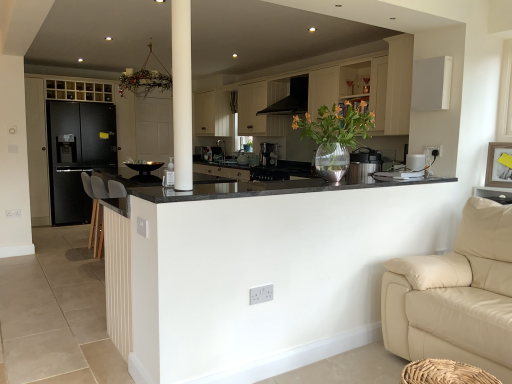
The width and height of the screenshot is (512, 384). What do you see at coordinates (456, 296) in the screenshot?
I see `beige leather couch at lower right` at bounding box center [456, 296].

The width and height of the screenshot is (512, 384). What do you see at coordinates (246, 187) in the screenshot? I see `black granite countertop at center` at bounding box center [246, 187].

At what (x,y) coordinates should I click in order to perform the action: click on clear glass vase at center. Please return your answer as a coordinate pair (x, y). The width and height of the screenshot is (512, 384). Looking at the image, I should click on (335, 136).

You are a GUI agent. You are given a task and a screenshot of the screen. Output one action in this format:
    pyautogui.click(x=<x>, y=<y>)
    Task: Click on the white plastic toaster at upper right, placed as the fourth appliance when sorted from left to right
    This screenshot has height=384, width=512.
    Given the screenshot: What is the action you would take?
    pyautogui.click(x=415, y=162)

Measure the distance between white plastic toaster at upper right, which is counted as the first appliance, starting from the front, and camera.

white plastic toaster at upper right, which is counted as the first appliance, starting from the front, and camera are 10.41 feet apart from each other.

Describe the element at coordinates (243, 158) in the screenshot. I see `satin silver toaster at center, the third appliance in the front-to-back sequence` at that location.

From the picture: What is the approximate width of black matte refrigerator at left, which ranks as the first cabinetry in left-to-right order?

It is 32.26 inches.

Where is `beige leather couch at lower right`? This screenshot has width=512, height=384. beige leather couch at lower right is located at coordinates (456, 296).

Does clear glass vase at center have a smaller size compared to satin black coffee maker at center, the 4th appliance in the front-to-back sequence?

No.

Relative to satin black coffee maker at center, arranged as the third appliance when viewed from the right, is clear glass vase at center in front or behind?

clear glass vase at center is in front of satin black coffee maker at center, arranged as the third appliance when viewed from the right.

Is clear glass vase at center next to satin black coffee maker at center, the first appliance viewed from the back?

clear glass vase at center and satin black coffee maker at center, the first appliance viewed from the back, are clearly separated.

From a real-world perspective, is clear glass vase at center physically below satin black coffee maker at center, which is counted as the second appliance, starting from the left?

No.

Considering the relative positions of clear glass vase at center and satin silver toaster at center, which is the 1th appliance in left-to-right order, in the image provided, is clear glass vase at center to the left or to the right of satin silver toaster at center, which is the 1th appliance in left-to-right order,?

Clearly, clear glass vase at center is on the right of satin silver toaster at center, which is the 1th appliance in left-to-right order, in the image.

From a real-world perspective, between clear glass vase at center and satin silver toaster at center, the 2th appliance positioned from the back, who is vertically lower?

satin silver toaster at center, the 2th appliance positioned from the back, from a real-world perspective.

Would you say clear glass vase at center is inside or outside satin silver toaster at center, the third appliance in the front-to-back sequence?

clear glass vase at center is spatially situated outside satin silver toaster at center, the third appliance in the front-to-back sequence.

The image size is (512, 384). I want to click on floral arrangement located in front of the satin silver toaster at center, the third appliance in the front-to-back sequence, so click(335, 136).

Does satin black coffee machine at center have a larger size compared to black granite countertop at center?

Actually, satin black coffee machine at center might be smaller than black granite countertop at center.

Which of these two, satin black coffee machine at center or black granite countertop at center, stands shorter?

Standing shorter between the two is black granite countertop at center.

Is point (259, 160) more distant than point (199, 196)?

Yes, it is.

Considering the sizes of objects satin black coffee machine at center and black matte exhaust hood at upper center in the image provided, who is taller, satin black coffee machine at center or black matte exhaust hood at upper center?

Standing taller between the two is black matte exhaust hood at upper center.

From a real-world perspective, which is physically below, satin black coffee machine at center or black matte exhaust hood at upper center?

satin black coffee machine at center.

How much distance is there between satin black coffee machine at center and black matte exhaust hood at upper center?

satin black coffee machine at center is 3.91 feet from black matte exhaust hood at upper center.

Considering the points (263, 163) and (305, 100), which point is in front, point (263, 163) or point (305, 100)?

The point (305, 100) is in front.

Between satin silver toaster at center, the third appliance in the front-to-back sequence, and white plastic toaster at upper right, placed as the fourth appliance when sorted from left to right, which one has less height?

With less height is white plastic toaster at upper right, placed as the fourth appliance when sorted from left to right.

From the image's perspective, which object appears higher, satin silver toaster at center, the 2th appliance positioned from the back, or white plastic toaster at upper right, placed as the fourth appliance when sorted from left to right?

satin silver toaster at center, the 2th appliance positioned from the back, from the image's perspective.

Is satin silver toaster at center, which is the 1th appliance in left-to-right order, far away from white plastic toaster at upper right, which appears as the first appliance when viewed from the right?

Yes, satin silver toaster at center, which is the 1th appliance in left-to-right order, is far from white plastic toaster at upper right, which appears as the first appliance when viewed from the right.

Which of these two, satin silver toaster at center, the third appliance in the front-to-back sequence, or white plastic toaster at upper right, which is counted as the first appliance, starting from the front, is wider?

satin silver toaster at center, the third appliance in the front-to-back sequence, is wider.

Which is further, [307,79] or [271,97]?

The point [271,97] is behind.

From the image's perspective, does black matte exhaust hood at upper center appear higher than white matte cabinet at upper center, positioned as the 2th cabinetry in left-to-right order?

Yes, from the image's perspective, black matte exhaust hood at upper center is over white matte cabinet at upper center, positioned as the 2th cabinetry in left-to-right order.

How different are the orientations of black matte exhaust hood at upper center and white matte cabinet at upper center, which is the first cabinetry from right to left, in degrees?

1.65 degrees.

Considering the sizes of objects black matte exhaust hood at upper center and white matte cabinet at upper center, positioned as the 2th cabinetry in left-to-right order, in the image provided, who is thinner, black matte exhaust hood at upper center or white matte cabinet at upper center, positioned as the 2th cabinetry in left-to-right order,?

white matte cabinet at upper center, positioned as the 2th cabinetry in left-to-right order, is thinner.

How many degrees apart are the facing directions of black matte exhaust hood at upper center and black matte refrigerator at left, which is counted as the 2th cabinetry, starting from the right?

The angular difference between black matte exhaust hood at upper center and black matte refrigerator at left, which is counted as the 2th cabinetry, starting from the right, is 90.1 degrees.

Is black matte exhaust hood at upper center inside or outside of black matte refrigerator at left, which is counted as the 2th cabinetry, starting from the right?

black matte exhaust hood at upper center is outside black matte refrigerator at left, which is counted as the 2th cabinetry, starting from the right.

From a real-world perspective, is black matte exhaust hood at upper center physically below black matte refrigerator at left, which is counted as the 2th cabinetry, starting from the right?

No, from a real-world perspective, black matte exhaust hood at upper center is not under black matte refrigerator at left, which is counted as the 2th cabinetry, starting from the right.

Is black matte exhaust hood at upper center looking in the opposite direction of black matte refrigerator at left, which ranks as the first cabinetry in left-to-right order?

black matte exhaust hood at upper center does not have its back to black matte refrigerator at left, which ranks as the first cabinetry in left-to-right order.

Which appliance is the 1st one when counting from the left side of the clear glass vase at center? Please provide its 2D coordinates.

[(252, 159)]

I want to click on floral arrangement on the right of satin silver toaster at center, the 2th appliance positioned from the back, so [x=335, y=136].

Estimate the real-world distances between objects in this image. Which object is closer to white matte cabinet at upper center, which is the first cabinetry from right to left, satin black coffee machine at center or satin black coffee maker at center, the 4th appliance in the front-to-back sequence?

Among the two, satin black coffee machine at center is located nearer to white matte cabinet at upper center, which is the first cabinetry from right to left.

Looking at the image, which one is located further to satin black coffee maker at center, which is counted as the second appliance, starting from the left, satin black coffee machine at center or clear glass vase at center?

clear glass vase at center lies further to satin black coffee maker at center, which is counted as the second appliance, starting from the left, than the other object.

Which object lies nearer to the anchor point black matte exhaust hood at upper center, white matte cabinet at upper center, which is the first cabinetry from right to left, or black matte refrigerator at left, which is counted as the 2th cabinetry, starting from the right?

Among the two, white matte cabinet at upper center, which is the first cabinetry from right to left, is located nearer to black matte exhaust hood at upper center.

Estimate the real-world distances between objects in this image. Which object is further from black matte exhaust hood at upper center, clear glass vase at center or black plastic thermos at center, which ranks as the second appliance in front-to-back order?

clear glass vase at center is positioned further to the anchor black matte exhaust hood at upper center.

From the image, which object appears to be farther from satin black coffee maker at center, the 4th appliance in the front-to-back sequence, black matte refrigerator at left, which ranks as the first cabinetry in left-to-right order, or black plastic thermos at center, which ranks as the second appliance in right-to-left order?

Among the two, black plastic thermos at center, which ranks as the second appliance in right-to-left order, is located further to satin black coffee maker at center, the 4th appliance in the front-to-back sequence.

Estimate the real-world distances between objects in this image. Which object is closer to black matte refrigerator at left, which ranks as the first cabinetry in left-to-right order, clear glass vase at center or white plastic toaster at upper right, which appears as the first appliance when viewed from the right?

clear glass vase at center is closer to black matte refrigerator at left, which ranks as the first cabinetry in left-to-right order.

Which object lies further to the anchor point black granite countertop at center, satin silver toaster at center, which is the 1th appliance in left-to-right order, or black matte refrigerator at left, which is counted as the 2th cabinetry, starting from the right?

The object further to black granite countertop at center is black matte refrigerator at left, which is counted as the 2th cabinetry, starting from the right.

Which object lies further to the anchor point satin black coffee maker at center, arranged as the third appliance when viewed from the right, beige leather couch at lower right or black matte exhaust hood at upper center?

Among the two, beige leather couch at lower right is located further to satin black coffee maker at center, arranged as the third appliance when viewed from the right.

Identify the location of exhaust hood positioned between white matte cabinet at upper center, which is the first cabinetry from right to left, and satin black coffee machine at center from near to far. Image resolution: width=512 pixels, height=384 pixels. (291, 99).

The height and width of the screenshot is (384, 512). What are the coordinates of `exhaust hood positioned between beige leather couch at lower right and black matte refrigerator at left, which ranks as the first cabinetry in left-to-right order, from near to far` in the screenshot? It's located at (291, 99).

At what (x,y) coordinates should I click in order to perform the action: click on exhaust hood between clear glass vase at center and black matte refrigerator at left, which ranks as the first cabinetry in left-to-right order, from front to back. Please return your answer as a coordinate pair (x, y). Looking at the image, I should click on (291, 99).

Where is `coffee machine between black granite countertop at center and satin black coffee maker at center, the 4th appliance in the front-to-back sequence, from front to back`? coffee machine between black granite countertop at center and satin black coffee maker at center, the 4th appliance in the front-to-back sequence, from front to back is located at coordinates (268, 154).